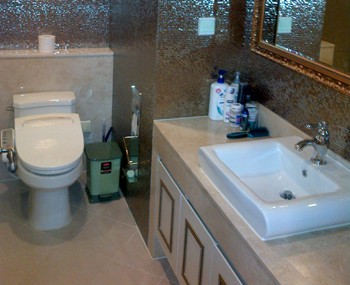
At what (x,y) coordinates should I click in order to perform the action: click on bath products. Please return your answer as a coordinate pair (x, y). Looking at the image, I should click on (221, 90), (228, 97), (235, 85), (241, 91), (235, 116), (243, 120), (251, 115).